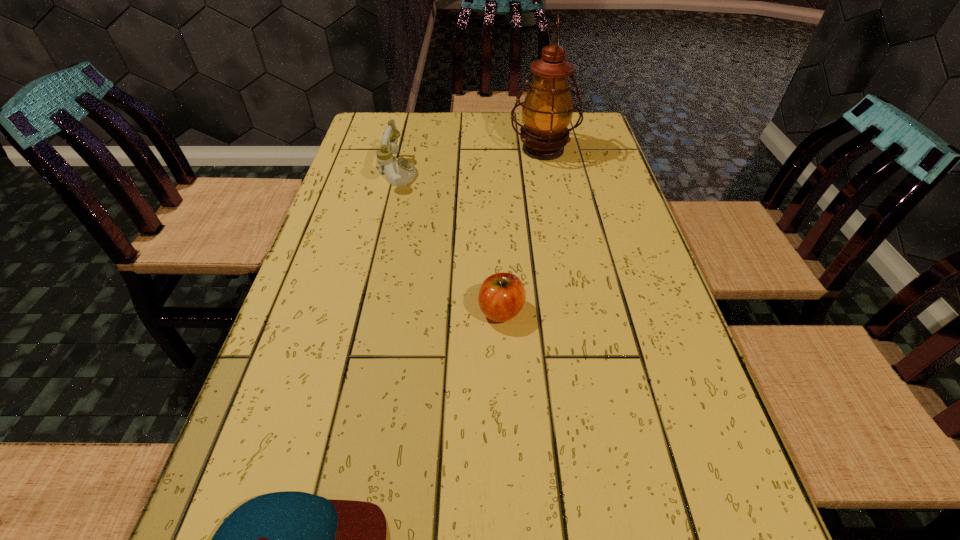
Locate an element on the screen. oil lamp is located at coordinates (547, 110).

You are a GUI agent. You are given a task and a screenshot of the screen. Output one action in this format:
    pyautogui.click(x=<x>, y=<y>)
    Task: Click on the second tallest object
    The height and width of the screenshot is (540, 960).
    Given the screenshot: What is the action you would take?
    pyautogui.click(x=399, y=172)

Where is `apple`? Image resolution: width=960 pixels, height=540 pixels. apple is located at coordinates tap(501, 297).

Find the location of a particular element. This screenshot has height=540, width=960. the second shortest object is located at coordinates (501, 297).

You are a GUI agent. You are given a task and a screenshot of the screen. Output one action in this format:
    pyautogui.click(x=<x>, y=<y>)
    Task: Click on the free location located 0.210m on the left of the oil lamp
    The image size is (960, 540).
    Given the screenshot: What is the action you would take?
    pyautogui.click(x=440, y=150)

The image size is (960, 540). I want to click on vacant space located on the dial of the telephone, so click(543, 173).

Where is `vacant region located 0.160m on the back of the apple`? vacant region located 0.160m on the back of the apple is located at coordinates (498, 244).

Image resolution: width=960 pixels, height=540 pixels. Find the location of `object present at the far edge`. object present at the far edge is located at coordinates (547, 110).

At what (x,y) coordinates should I click in order to perform the action: click on object that is at the left edge. Please return your answer as a coordinate pair (x, y). The height and width of the screenshot is (540, 960). Looking at the image, I should click on (399, 172).

Locate an element on the screen. object that is at the right edge is located at coordinates coord(547,110).